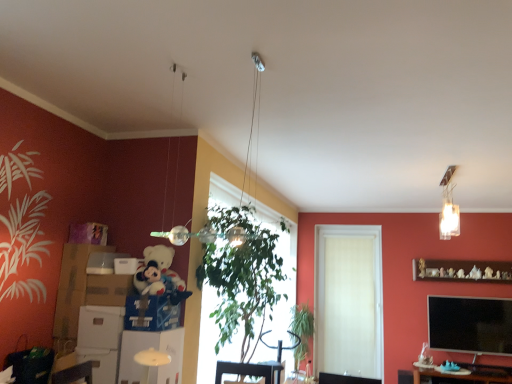
This screenshot has width=512, height=384. Describe the element at coordinates (103, 262) in the screenshot. I see `matte cardboard box at left, placed as the 2th box when sorted from top to bottom` at that location.

What do you see at coordinates (242, 285) in the screenshot? The image size is (512, 384). I see `green leafy plant at center` at bounding box center [242, 285].

Where is `purple cardboard box at left, which is the 1th box in top-to-bottom order`? The image size is (512, 384). purple cardboard box at left, which is the 1th box in top-to-bottom order is located at coordinates [x=88, y=233].

This screenshot has height=384, width=512. Identify the location of soft plush toy at left. (158, 272).

At what (x,y) coordinates should I click in order to perform the action: click on matte cardboard box at left, which appears as the first box when ordered from the bottom. Please return your answer as a coordinate pair (x, y). Looking at the image, I should click on (103, 262).

From a real-world perspective, is brown cardboard box at left, which appears as the second cardboard box when viewed from the left, physically above metallic silver swivel chair at center?

Yes, from a real-world perspective, brown cardboard box at left, which appears as the second cardboard box when viewed from the left, is over metallic silver swivel chair at center

Which of these two, brown cardboard box at left, which appears as the second cardboard box when viewed from the left, or metallic silver swivel chair at center, is smaller?

Smaller between the two is brown cardboard box at left, which appears as the second cardboard box when viewed from the left.

Does brown cardboard box at left, which is the second cardboard box from right to left, have a lesser width compared to metallic silver swivel chair at center?

Indeed, brown cardboard box at left, which is the second cardboard box from right to left, has a lesser width compared to metallic silver swivel chair at center.

Is blue cardboard box at lower left, the 3th cardboard box viewed from the left, positioned beyond the bounds of purple cardboard box at left, which is the 1th box in top-to-bottom order?

Yes.

Is blue cardboard box at lower left, the 3th cardboard box viewed from the left, in front of or behind purple cardboard box at left, which is the 1th box in top-to-bottom order, in the image?

blue cardboard box at lower left, the 3th cardboard box viewed from the left, is positioned closer to the viewer than purple cardboard box at left, which is the 1th box in top-to-bottom order.

Between blue cardboard box at lower left, the 3th cardboard box viewed from the left, and purple cardboard box at left, which is the 1th box in top-to-bottom order, which one appears on the left side from the viewer's perspective?

purple cardboard box at left, which is the 1th box in top-to-bottom order, is more to the left.

Between brown wooden table at lower right and matte cardboard box at left, which appears as the first box when ordered from the bottom, which one has more height?

brown wooden table at lower right.

Looking at this image, does brown wooden table at lower right contain matte cardboard box at left, which appears as the first box when ordered from the bottom?

No, matte cardboard box at left, which appears as the first box when ordered from the bottom, is not surrounded by brown wooden table at lower right.

Is brown wooden table at lower right positioned with its back to matte cardboard box at left, placed as the 2th box when sorted from top to bottom?

No, brown wooden table at lower right is not facing the opposite direction of matte cardboard box at left, placed as the 2th box when sorted from top to bottom.

Which is further, (x=475, y=377) or (x=102, y=266)?

The point (x=475, y=377) is behind.

Does white matte door at center have a smaller size compared to brown cardboard box at left, which appears as the second cardboard box when viewed from the left?

Incorrect, white matte door at center is not smaller in size than brown cardboard box at left, which appears as the second cardboard box when viewed from the left.

Would you consider white matte door at center to be distant from brown cardboard box at left, which appears as the second cardboard box when viewed from the left?

That's right, there is a large distance between white matte door at center and brown cardboard box at left, which appears as the second cardboard box when viewed from the left.

Which is behind, white matte door at center or brown cardboard box at left, which appears as the second cardboard box when viewed from the left?

white matte door at center is further from the camera.

Between purple cardboard box at left, which is the 1th box in top-to-bottom order, and white matte door at center, which one has larger size?

Bigger between the two is white matte door at center.

Is white matte door at center surrounded by purple cardboard box at left, which is the 1th box in top-to-bottom order?

No, purple cardboard box at left, which is the 1th box in top-to-bottom order, does not contain white matte door at center.

Can you confirm if purple cardboard box at left, which ranks as the second box in bottom-to-top order, is shorter than white matte door at center?

Correct, purple cardboard box at left, which ranks as the second box in bottom-to-top order, is not as tall as white matte door at center.

From a real-world perspective, who is located higher, purple cardboard box at left, which is the 1th box in top-to-bottom order, or white matte door at center?

purple cardboard box at left, which is the 1th box in top-to-bottom order, from a real-world perspective.

From the image's perspective, is green leafy plant at center under purple cardboard box at left, which is the 1th box in top-to-bottom order?

Correct, green leafy plant at center appears lower than purple cardboard box at left, which is the 1th box in top-to-bottom order, in the image.

Is there a large distance between green leafy plant at center and purple cardboard box at left, which is the 1th box in top-to-bottom order?

Yes, green leafy plant at center is far from purple cardboard box at left, which is the 1th box in top-to-bottom order.

Does green leafy plant at center turn towards purple cardboard box at left, which ranks as the second box in bottom-to-top order?

No, green leafy plant at center does not turn towards purple cardboard box at left, which ranks as the second box in bottom-to-top order.

Which object is more forward, green leafy plant at center or purple cardboard box at left, which is the 1th box in top-to-bottom order?

green leafy plant at center is closer to the camera.

Which object is positioned more to the left, blue cardboard box at lower left, the 3th cardboard box viewed from the left, or soft plush toy at left?

From the viewer's perspective, blue cardboard box at lower left, the 3th cardboard box viewed from the left, appears more on the left side.

In the scene shown: From the image's perspective, would you say blue cardboard box at lower left, the 3th cardboard box viewed from the left, is shown under soft plush toy at left?

Yes.

This screenshot has height=384, width=512. I want to click on toy on the right side of blue cardboard box at lower left, the 3th cardboard box viewed from the left, so click(158, 272).

From a real-world perspective, which object stands above the other?

soft plush toy at left is physically above.

The width and height of the screenshot is (512, 384). Find the location of `the 1st cardboard box in front of the metallic silver swivel chair at center, starting your count from the anchor`. the 1st cardboard box in front of the metallic silver swivel chair at center, starting your count from the anchor is located at coordinates (108, 289).

The height and width of the screenshot is (384, 512). I want to click on the 2nd box located above the blue cardboard box at lower left, which is the first cardboard box in right-to-left order (from a real-world perspective), so click(88, 233).

Looking at the image, which one is located closer to wooden shelf at upper right, the second shelf viewed from the front, white matte door at center or green leafy plant at center?

white matte door at center lies closer to wooden shelf at upper right, the second shelf viewed from the front, than the other object.

Based on the photo, considering their positions, is brown cardboard box at left, which appears as the second cardboard box when viewed from the left, positioned further to green leafy plant at center than blue cardboard box at lower left, which is the first cardboard box in right-to-left order?

The object further to green leafy plant at center is brown cardboard box at left, which appears as the second cardboard box when viewed from the left.

Based on their spatial positions, is brown wooden table at lower right or purple cardboard box at left, which is the 1th box in top-to-bottom order, further from metallic silver swivel chair at center?

purple cardboard box at left, which is the 1th box in top-to-bottom order, is positioned further to the anchor metallic silver swivel chair at center.

Based on their spatial positions, is clear glass light fixture at upper right or brown cardboard box at left, which is the second cardboard box from right to left, closer to blue cardboard box at lower left, the 3th cardboard box viewed from the left?

Among the two, brown cardboard box at left, which is the second cardboard box from right to left, is located nearer to blue cardboard box at lower left, the 3th cardboard box viewed from the left.

Considering their positions, is brown cardboard box at left, which appears as the second cardboard box when viewed from the left, positioned further to matte cardboard box at left, which appears as the first box when ordered from the bottom, than white glossy shelf at lower center, which ranks as the second shelf in back-to-front order?

white glossy shelf at lower center, which ranks as the second shelf in back-to-front order, is further to matte cardboard box at left, which appears as the first box when ordered from the bottom.

Which object lies further to the anchor point green leafy plant at center, matte cardboard box at left, which appears as the first box when ordered from the bottom, or brown wooden table at lower right?

matte cardboard box at left, which appears as the first box when ordered from the bottom, lies further to green leafy plant at center than the other object.

From the image, which object appears to be farther from brown cardboard box at left, which is the second cardboard box from right to left, green leafy plant at center or blue cardboard box at lower left, the 3th cardboard box viewed from the left?

green leafy plant at center lies further to brown cardboard box at left, which is the second cardboard box from right to left, than the other object.

Based on their spatial positions, is brown cardboard box at left, which is the second cardboard box from right to left, or green leafy plant at center closer to blue cardboard box at lower left, the 3th cardboard box viewed from the left?

brown cardboard box at left, which is the second cardboard box from right to left, is positioned closer to the anchor blue cardboard box at lower left, the 3th cardboard box viewed from the left.

The width and height of the screenshot is (512, 384). Find the location of `toy between purple cardboard box at left, which ranks as the second box in bottom-to-top order, and green leafy plant at center from left to right`. toy between purple cardboard box at left, which ranks as the second box in bottom-to-top order, and green leafy plant at center from left to right is located at coordinates (158, 272).

Where is `light fixture between green leafy plant at center and green leafy plant at center from front to back`? The image size is (512, 384). light fixture between green leafy plant at center and green leafy plant at center from front to back is located at coordinates (449, 208).

Locate an element on the screen. shelf between soft plush toy at left and clear glass light fixture at upper right is located at coordinates (155, 349).

Identify the location of plant between brown cardboard box at left, which appears as the second cardboard box when viewed from the left, and white matte door at center from front to back. The image size is (512, 384). (301, 330).